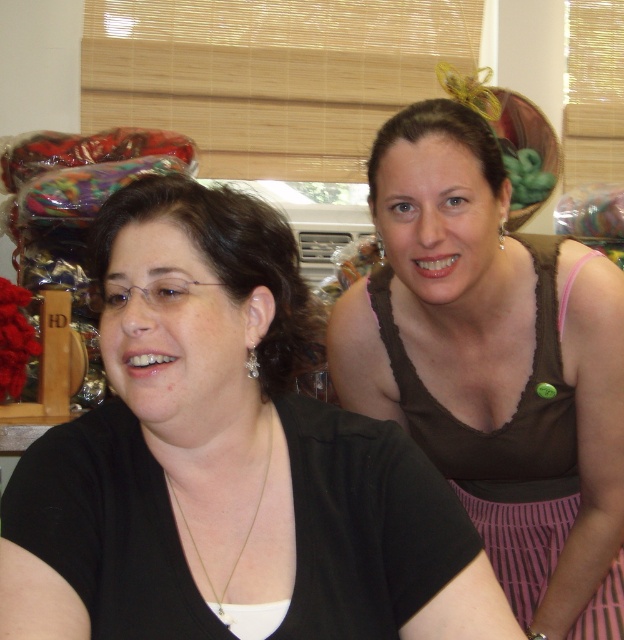
Is pink striped fabric dress at upper right bigger than gold chain necklace at center?

Yes.

Measure the distance between point (547,314) and camera.

Point (547,314) is 3.52 feet from camera.

What do you see at coordinates (504, 442) in the screenshot? The height and width of the screenshot is (640, 624). I see `pink striped fabric dress at upper right` at bounding box center [504, 442].

Where is `pink striped fabric dress at upper right`? pink striped fabric dress at upper right is located at coordinates (504, 442).

Does matte black shirt at upper right have a greater width compared to gold chain necklace at center?

Yes, matte black shirt at upper right is wider than gold chain necklace at center.

Who is positioned more to the right, matte black shirt at upper right or gold chain necklace at center?

gold chain necklace at center

Is point (56, 540) closer to camera compared to point (222, 616)?

Yes.

Where is `matte black shirt at upper right`? Image resolution: width=624 pixels, height=640 pixels. matte black shirt at upper right is located at coordinates (227, 458).

Who is positioned more to the left, matte black shirt at upper right or pink striped fabric dress at upper right?

matte black shirt at upper right is more to the left.

Between point (228, 563) and point (582, 628), which one is positioned behind?

The point (582, 628) is behind.

This screenshot has width=624, height=640. Identify the location of matte black shirt at upper right. (227, 458).

Where is `matte black shirt at upper right`? This screenshot has height=640, width=624. matte black shirt at upper right is located at coordinates (227, 458).